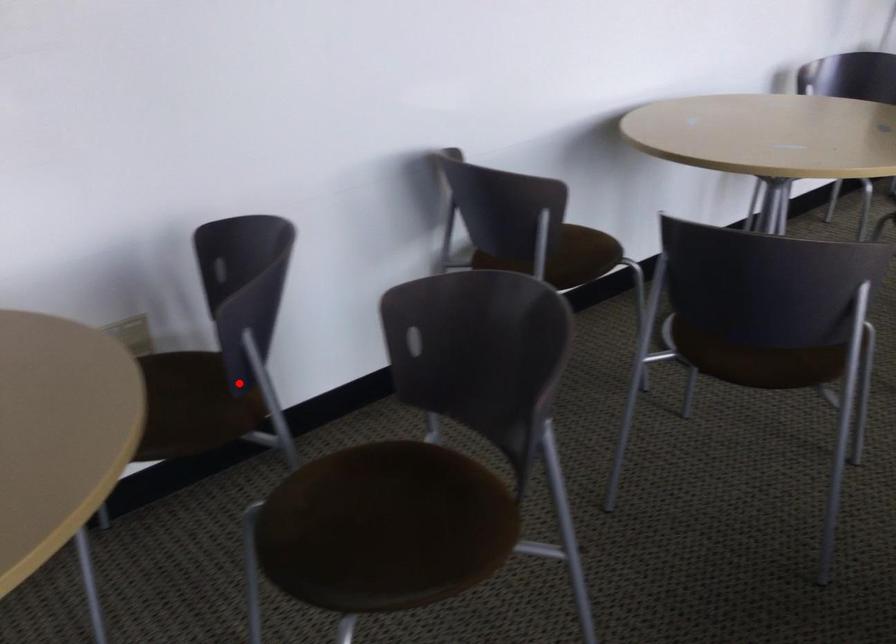
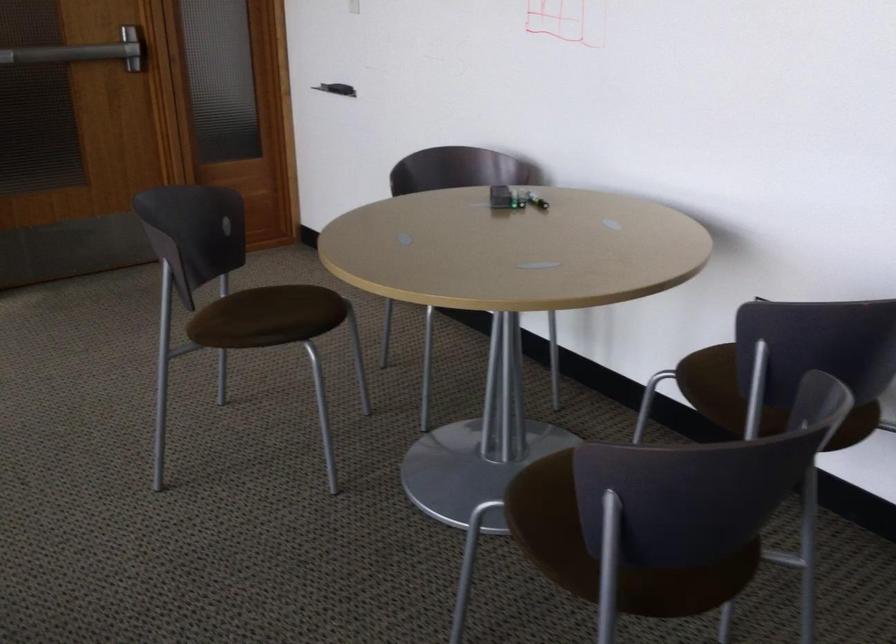
In the second image, find the point that corresponds to the highlighted location in the first image.

(745, 386)